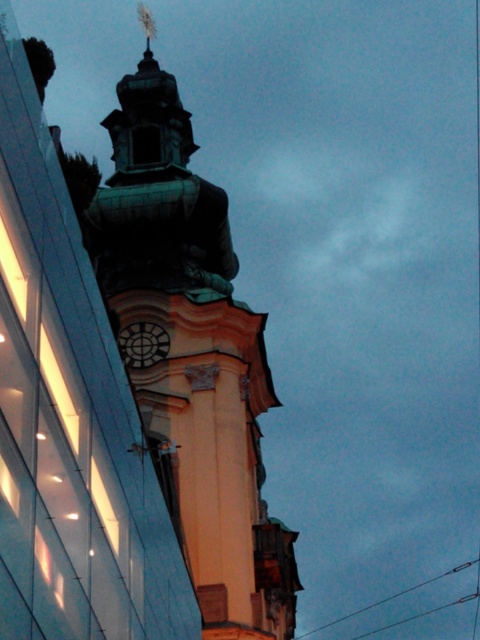
Consider the image. Is the position of green patina tower at center less distant than that of matte black clock at center?

Yes, green patina tower at center is closer to the viewer.

What do you see at coordinates (193, 356) in the screenshot?
I see `green patina tower at center` at bounding box center [193, 356].

Does point (208, 582) lie in front of point (168, 336)?

Yes, point (208, 582) is closer to viewer.

The width and height of the screenshot is (480, 640). I want to click on green patina tower at center, so click(193, 356).